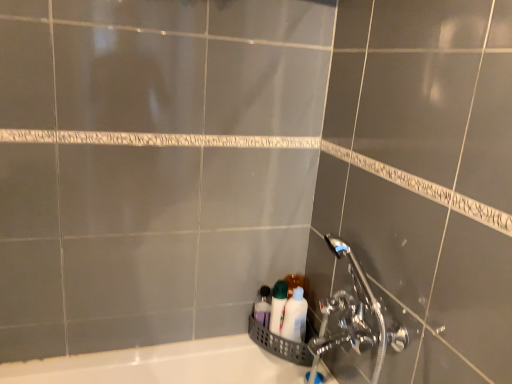
Question: Relative to white glossy bottles at lower right, which ranks as the first toiletry in right-to-left order, is translucent plastic bottles at lower center, marked as the 1th toiletry in a left-to-right arrangement, in front or behind?

Choices:
 (A) front
 (B) behind

Answer: (B)

Question: Is translucent plastic bottles at lower center, which ranks as the 2th toiletry in right-to-left order, taller or shorter than white glossy bottles at lower right, the second toiletry positioned from the left?

Choices:
 (A) short
 (B) tall

Answer: (A)

Question: In terms of width, does translucent plastic bottles at lower center, which ranks as the 2th toiletry in right-to-left order, look wider or thinner when compared to white glossy bottles at lower right, the second toiletry positioned from the left?

Choices:
 (A) wide
 (B) thin

Answer: (B)

Question: In terms of width, does white glossy bottles at lower right, which ranks as the first toiletry in right-to-left order, look wider or thinner when compared to translucent plastic bottles at lower center, which ranks as the 2th toiletry in right-to-left order?

Choices:
 (A) wide
 (B) thin

Answer: (A)

Question: Considering the positions of white glossy bottles at lower right, which ranks as the first toiletry in right-to-left order, and translucent plastic bottles at lower center, which ranks as the 2th toiletry in right-to-left order, in the image, is white glossy bottles at lower right, which ranks as the first toiletry in right-to-left order, taller or shorter than translucent plastic bottles at lower center, which ranks as the 2th toiletry in right-to-left order,?

Choices:
 (A) tall
 (B) short

Answer: (A)

Question: Is white glossy bottles at lower right, which ranks as the first toiletry in right-to-left order, in front of or behind translucent plastic bottles at lower center, which ranks as the 2th toiletry in right-to-left order, in the image?

Choices:
 (A) behind
 (B) front

Answer: (B)

Question: Is point [x=283, y=317] positioned closer to the camera than point [x=269, y=311]?

Choices:
 (A) closer
 (B) farther

Answer: (A)